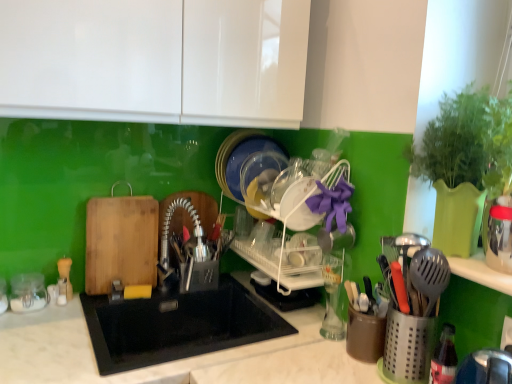
Question: In terms of size, does clear glass jar at left appear bigger or smaller than black matte sink at center?

Choices:
 (A) big
 (B) small

Answer: (B)

Question: Considering their positions, is clear glass jar at left located in front of or behind black matte sink at center?

Choices:
 (A) behind
 (B) front

Answer: (A)

Question: Estimate the real-world distances between objects in this image. Which object is closer to the clear glass jar at left?

Choices:
 (A) white plastic dish rack at center
 (B) black matte sink at center

Answer: (B)

Question: Considering the real-world distances, which object is closest to the white plastic dish rack at center?

Choices:
 (A) clear glass jar at left
 (B) black matte sink at center

Answer: (B)